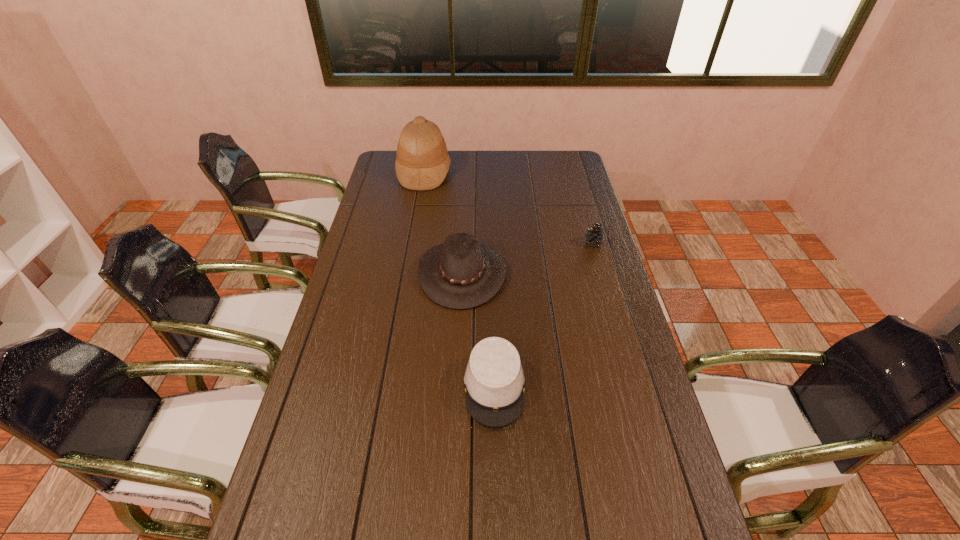
Find the location of a particular element. Image resolution: width=960 pixels, height=540 pixels. vacant space that's between the nearest hat and the rightmost object is located at coordinates (544, 315).

Locate an element on the screen. This screenshot has height=540, width=960. vacant space that is in between the second tallest object and the shortest hat is located at coordinates (478, 330).

The height and width of the screenshot is (540, 960). What are the coordinates of `vacant area that lies between the second shortest hat and the nearest hat` in the screenshot? It's located at (478, 330).

The width and height of the screenshot is (960, 540). I want to click on unoccupied position between the second shortest hat and the nearest object, so click(x=478, y=330).

You are a GUI agent. You are given a task and a screenshot of the screen. Output one action in this format:
    pyautogui.click(x=<x>, y=<y>)
    Task: Click on the vacant space that's between the pinecone and the nearest hat
    
    Given the screenshot: What is the action you would take?
    pyautogui.click(x=544, y=315)

You are a GUI agent. You are given a task and a screenshot of the screen. Output one action in this format:
    pyautogui.click(x=<x>, y=<y>)
    Task: Click on the free space between the nearest object and the pinecone
    
    Given the screenshot: What is the action you would take?
    pyautogui.click(x=544, y=315)

Locate an element on the screen. The width and height of the screenshot is (960, 540). free point between the second farthest hat and the nearest object is located at coordinates (478, 330).

The height and width of the screenshot is (540, 960). What are the coordinates of `free space between the nearest object and the rightmost object` in the screenshot? It's located at (544, 315).

Image resolution: width=960 pixels, height=540 pixels. What are the coordinates of `object that is the second closest one to the pinecone` in the screenshot? It's located at (494, 380).

Locate an element on the screen. The width and height of the screenshot is (960, 540). the third closest object to the pinecone is located at coordinates (422, 162).